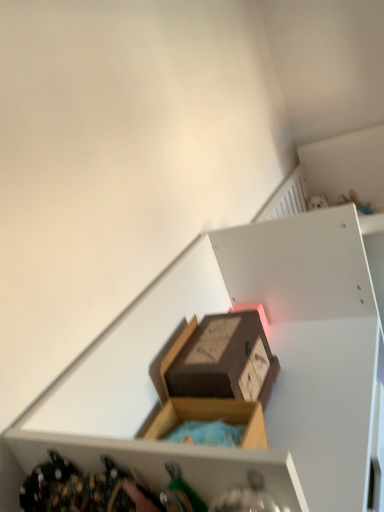
The width and height of the screenshot is (384, 512). What do you see at coordinates (221, 359) in the screenshot?
I see `matte brown box at center` at bounding box center [221, 359].

Locate an element on the screen. The height and width of the screenshot is (512, 384). matte brown box at center is located at coordinates (221, 359).

Find the location of `wooden box at upper center`. wooden box at upper center is located at coordinates (270, 346).

Image resolution: width=384 pixels, height=512 pixels. Describe the element at coordinates (270, 346) in the screenshot. I see `wooden box at upper center` at that location.

At what (x,y) coordinates should I click in order to perform the action: click on matte brown box at center. Please return your answer as a coordinate pair (x, y). This screenshot has height=512, width=384. Looking at the image, I should click on (221, 359).

Which is more to the right, matte brown box at center or wooden box at upper center?

From the viewer's perspective, wooden box at upper center appears more on the right side.

Between matte brown box at center and wooden box at upper center, which one is positioned in front?

wooden box at upper center is in front.

Which is closer to the camera, (241, 378) or (361, 506)?

Point (241, 378) is farther from the camera than point (361, 506).

From the image's perspective, who appears lower, matte brown box at center or wooden box at upper center?

wooden box at upper center is shown below in the image.

From a real-world perspective, between matte brown box at center and wooden box at upper center, who is vertically lower?

wooden box at upper center, from a real-world perspective.

Looking at their sizes, would you say matte brown box at center is wider or thinner than wooden box at upper center?

Clearly, matte brown box at center has less width compared to wooden box at upper center.

Consider the image. Considering the sizes of matte brown box at center and wooden box at upper center in the image, is matte brown box at center taller or shorter than wooden box at upper center?

In the image, matte brown box at center appears to be shorter than wooden box at upper center.

Based on their sizes in the image, would you say matte brown box at center is bigger or smaller than wooden box at upper center?

matte brown box at center is smaller than wooden box at upper center.

Is matte brown box at center not inside wooden box at upper center?

That's incorrect, matte brown box at center is not completely outside wooden box at upper center.

Would you say matte brown box at center is a long distance from wooden box at upper center?

No, matte brown box at center is not far from wooden box at upper center.

Does matte brown box at center turn towards wooden box at upper center?

Yes, matte brown box at center faces towards wooden box at upper center.

What's the angular difference between matte brown box at center and wooden box at upper center's facing directions?

0.0423 degrees separate the facing orientations of matte brown box at center and wooden box at upper center.

Identify the location of box lying on the left of wooden box at upper center. Image resolution: width=384 pixels, height=512 pixels. (221, 359).

Considering the positions of objects wooden box at upper center and matte brown box at center in the image provided, who is more to the left, wooden box at upper center or matte brown box at center?

matte brown box at center.

Is wooden box at upper center in front of or behind matte brown box at center in the image?

Visually, wooden box at upper center is located in front of matte brown box at center.

Is point (77, 378) positioned after point (270, 376)?

No, it is not.

From the image's perspective, is wooden box at upper center on top of matte brown box at center?

No.

From a real-world perspective, which is physically below, wooden box at upper center or matte brown box at center?

From a 3D spatial view, wooden box at upper center is below.

Can you confirm if wooden box at upper center is wider than matte brown box at center?

Indeed, wooden box at upper center has a greater width compared to matte brown box at center.

Can you confirm if wooden box at upper center is taller than matte brown box at center?

Yes.

Considering the relative sizes of wooden box at upper center and matte brown box at center in the image provided, is wooden box at upper center bigger than matte brown box at center?

Yes, wooden box at upper center is bigger than matte brown box at center.

Is wooden box at upper center inside the boundaries of matte brown box at center, or outside?

wooden box at upper center is not enclosed by matte brown box at center.

Is wooden box at upper center far from matte brown box at center?

They are positioned close to each other.

Is wooden box at upper center positioned with its back to matte brown box at center?

Correct, wooden box at upper center is looking away from matte brown box at center.

How many degrees apart are the facing directions of wooden box at upper center and matte brown box at center?

The facing directions of wooden box at upper center and matte brown box at center are 0.0423 degrees apart.

Identify the location of box positioned vertically above the wooden box at upper center (from a real-world perspective). The width and height of the screenshot is (384, 512). (221, 359).

At what (x,y) coordinates should I click in order to perform the action: click on box above the wooden box at upper center (from a real-world perspective). Please return your answer as a coordinate pair (x, y). This screenshot has width=384, height=512. Looking at the image, I should click on (221, 359).

In order to click on box located above the wooden box at upper center (from the image's perspective) in this screenshot , I will do `click(221, 359)`.